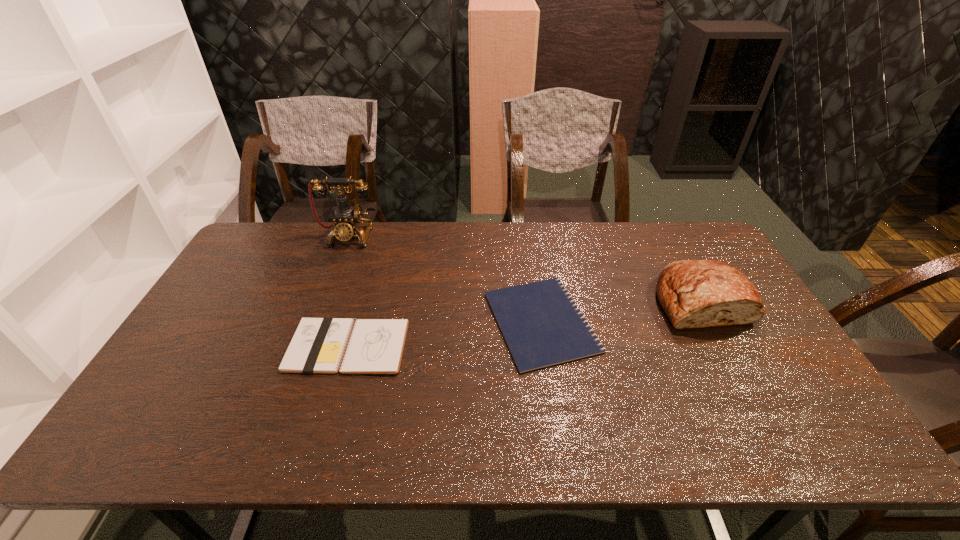
At what (x,y) coordinates should I click in order to perform the action: click on the tallest object. Please return your answer as a coordinate pair (x, y). This screenshot has height=540, width=960. Looking at the image, I should click on (346, 219).

Identify the location of telephone. (346, 219).

This screenshot has height=540, width=960. I want to click on the rightmost object, so click(693, 293).

Locate an element on the screen. bread is located at coordinates (693, 293).

Locate an element on the screen. The image size is (960, 540). the taller notepad is located at coordinates (375, 346).

At what (x,y) coordinates should I click in order to perform the action: click on the second shortest object. Please return your answer as a coordinate pair (x, y). This screenshot has width=960, height=540. Looking at the image, I should click on (375, 346).

Find the location of a particular element. Image resolution: width=960 pixels, height=540 pixels. the shorter notepad is located at coordinates (540, 322).

Identify the location of the second object from right to left. The width and height of the screenshot is (960, 540). (540, 322).

What are the coordinates of `vacant space located 0.070m on the front of the tallest object, featuring the rotary dial` in the screenshot? It's located at (339, 262).

You are a GUI agent. You are given a task and a screenshot of the screen. Output one action in this format:
    pyautogui.click(x=<x>, y=<y>)
    Task: Click on the blank space located 0.310m at the sliced front of the bread
    The width and height of the screenshot is (960, 540).
    Given the screenshot: What is the action you would take?
    pyautogui.click(x=775, y=435)